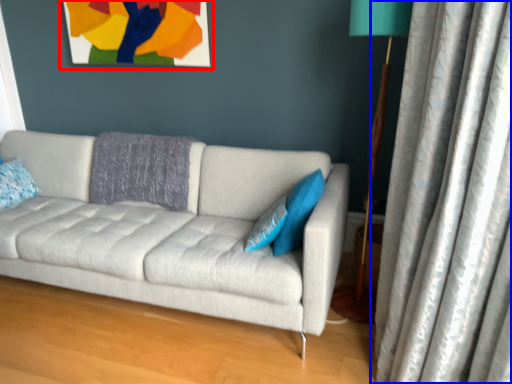
Question: Which of the following is the closest to the observer, picture frame (highlighted by a red box) or curtain (highlighted by a blue box)?

Choices:
 (A) picture frame
 (B) curtain

Answer: (B)